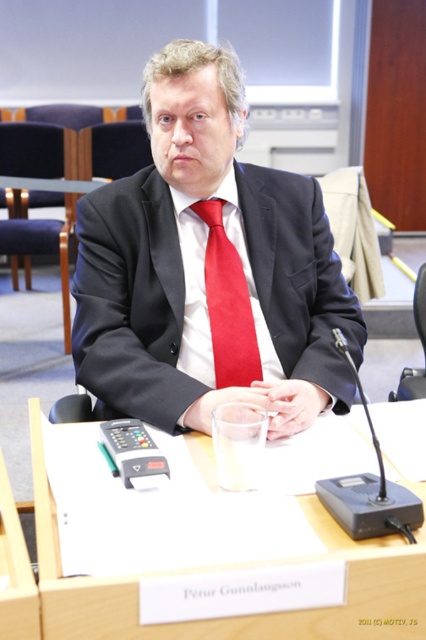
In the scene shown: Based on the scene description, what object is located at the coordinates point (209, 268)?

The object located at point (209, 268) is the matte black suit at center.

You are a photographer standing in front of the black leather chair at center. You want to take a closeup photo of the chair. Considering your current position, will you need to move closer or farther away to achieve this?

The black leather chair at center is 5.01 feet away from the viewer, so to take a closeup photo, you would need to move closer to the chair.

You are a photographer standing in front of the clear glass table at center and the matte black suit at center. You want to take a photo of the person seated at the table. Which object should you focus on first to ensure the person is in focus?

The matte black suit at center has a greater height compared to the clear glass table at center, so you should focus on the matte black suit at center first to ensure the person is in focus.